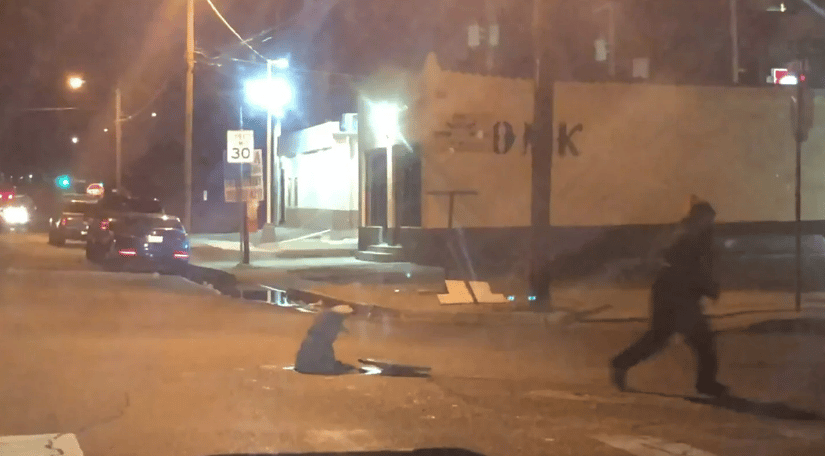
Identify the location of bright white light. Image resolution: width=825 pixels, height=456 pixels. (788, 78), (267, 93), (384, 121), (74, 84), (17, 216).